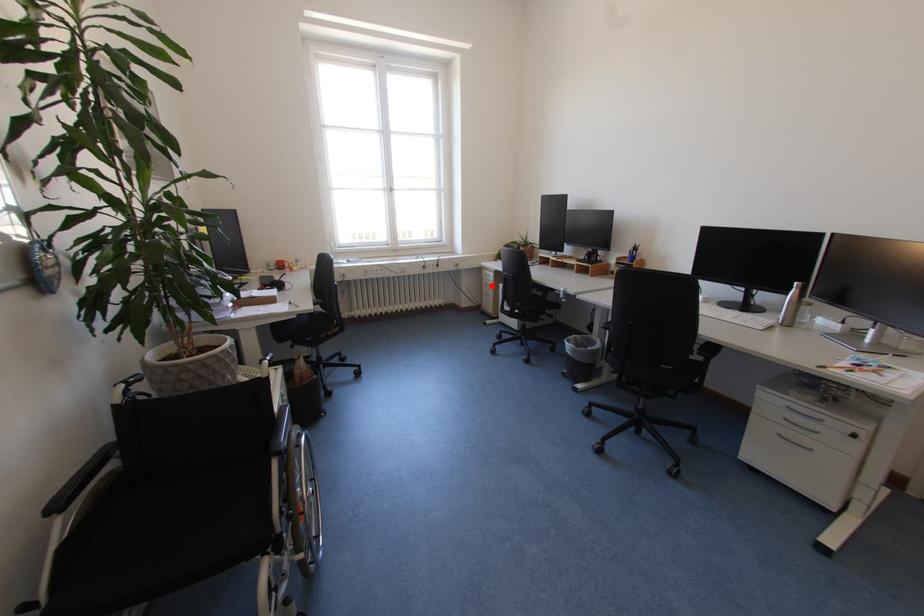
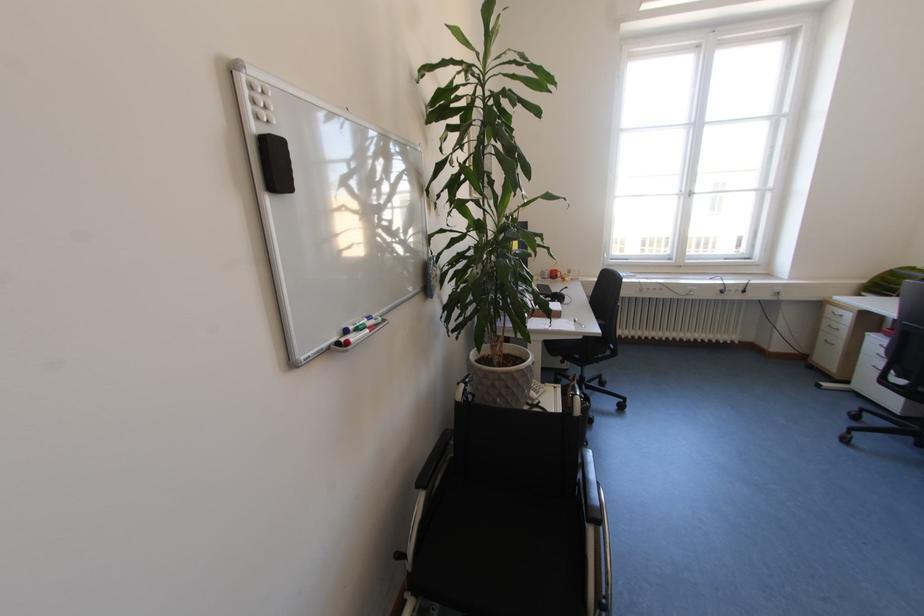
Where in the second image is the point corresponding to the highlighted location from the first image?

(833, 328)